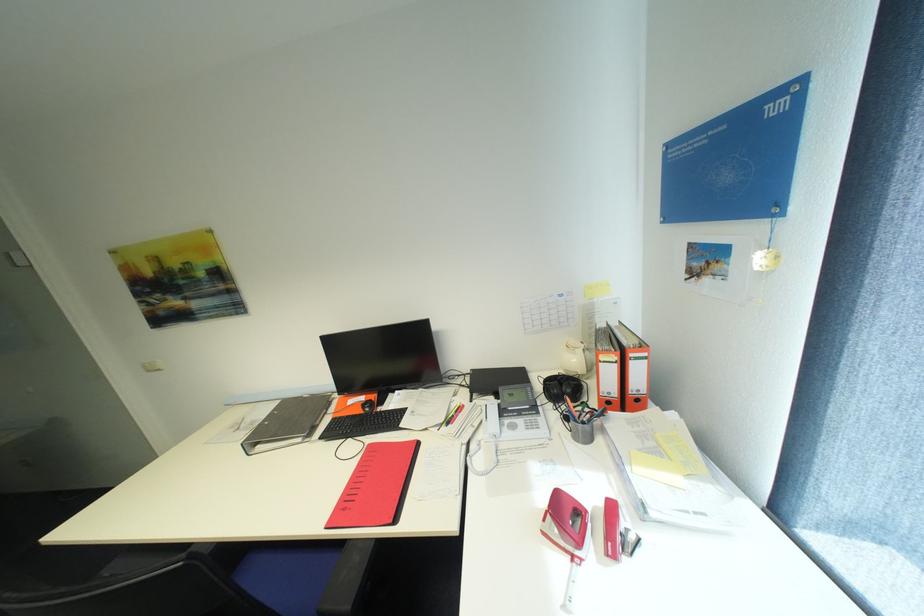
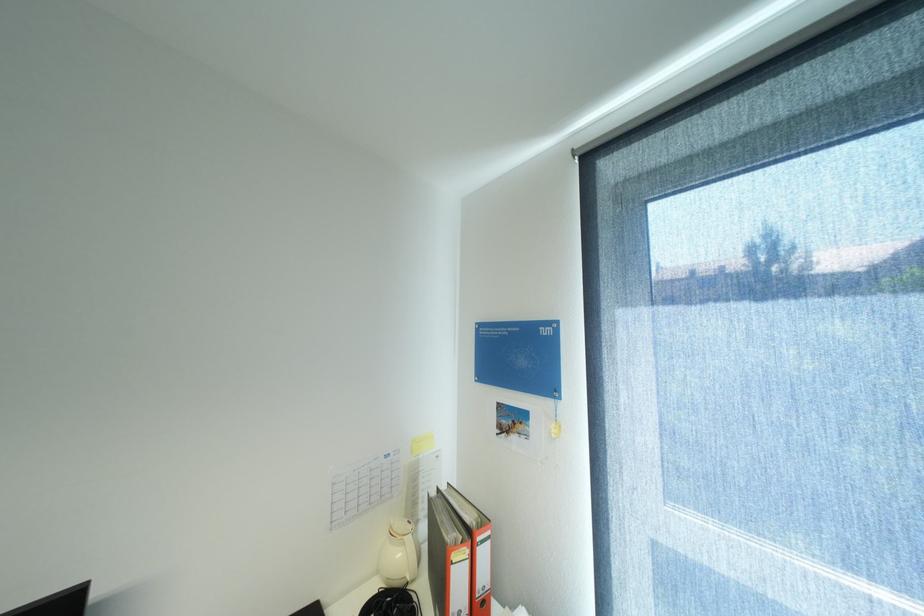
Locate, in the second image, the point that corresponds to (x=582, y=361) in the first image.

(407, 554)